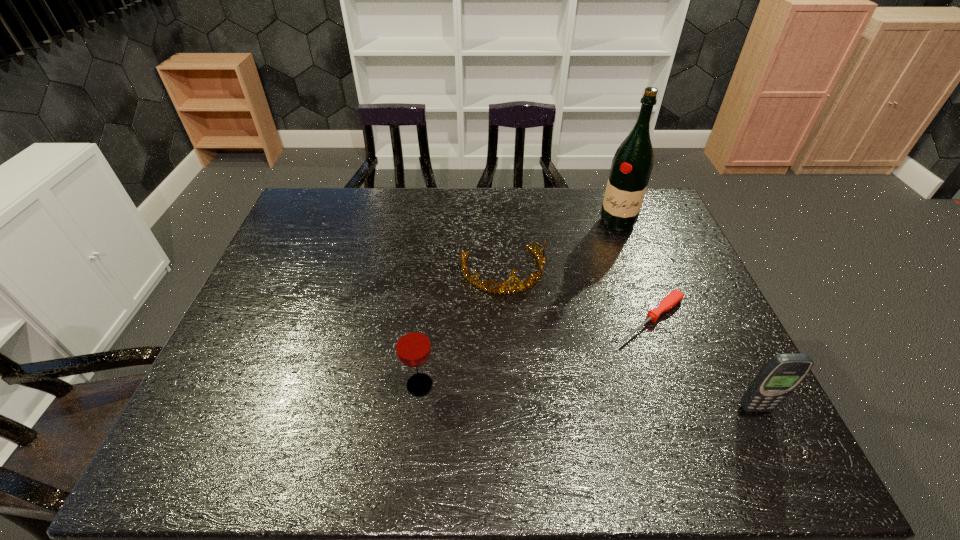
You are a GUI agent. You are given a task and a screenshot of the screen. Output one action in this format:
    pyautogui.click(x=<x>, y=<y>)
    Task: Click on the vacant spot on the desktop that is between the fourth farthest object and the cellular telephone and is positioned on the front-facing side of the tallest object
    
    Given the screenshot: What is the action you would take?
    pyautogui.click(x=569, y=395)

The height and width of the screenshot is (540, 960). Identify the location of vacant space on the desktop that is between the second nearest object and the nearest object and is positioned at the tip of the shortest object. (561, 395).

Where is `vacant space on the desktop that is between the leftmost object and the cellular telephone and is positioned on the front-facing side of the tiara`? This screenshot has width=960, height=540. vacant space on the desktop that is between the leftmost object and the cellular telephone and is positioned on the front-facing side of the tiara is located at coordinates (541, 393).